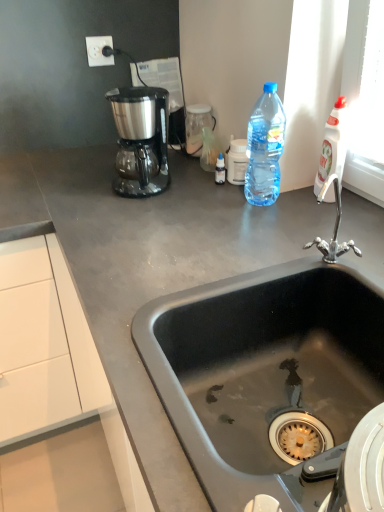
This screenshot has height=512, width=384. I want to click on vacant area that is situated to the right of satin black coffee maker at upper left, so click(x=189, y=184).